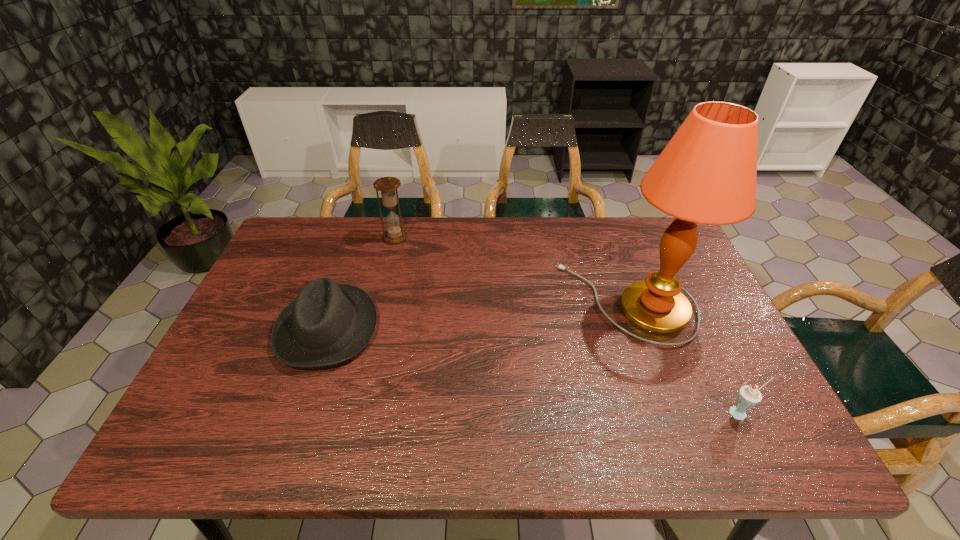
Where is `vacant area between the nearest object and the lamp`? vacant area between the nearest object and the lamp is located at coordinates (684, 358).

Point out which object is positioned as the third nearest to the farthest object. Please provide its 2D coordinates. Your answer should be formatted as a tuple, i.e. [(x, y)], where the tuple contains the x and y coordinates of a point satisfying the conditions above.

[(749, 396)]

Identify the location of object that is the second closest one to the hourglass. The height and width of the screenshot is (540, 960). (706, 174).